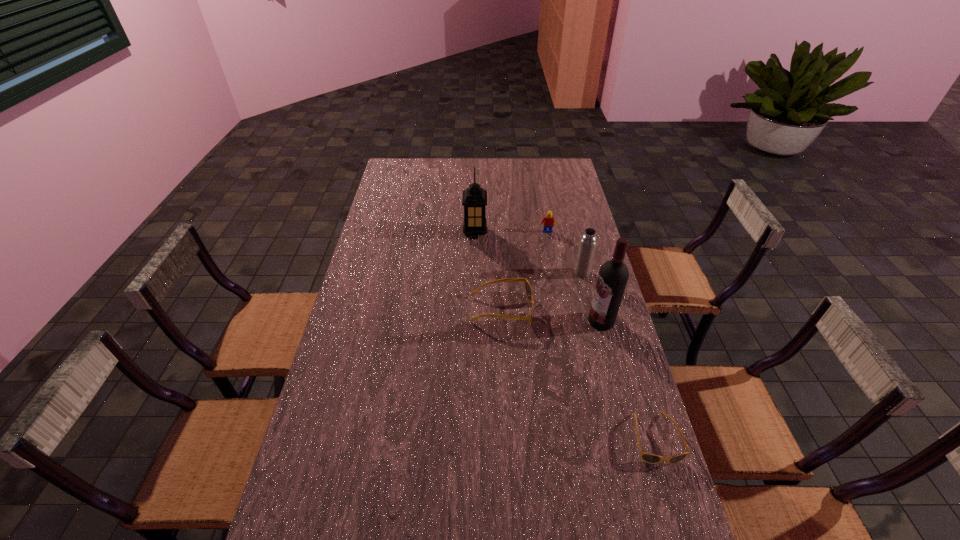
The image size is (960, 540). Find the location of `free space that satisfies the following two spatial constraints: 1. on the front-facing side of the Lego; 2. on the front-facing side of the left sunglasses`. free space that satisfies the following two spatial constraints: 1. on the front-facing side of the Lego; 2. on the front-facing side of the left sunglasses is located at coordinates (561, 310).